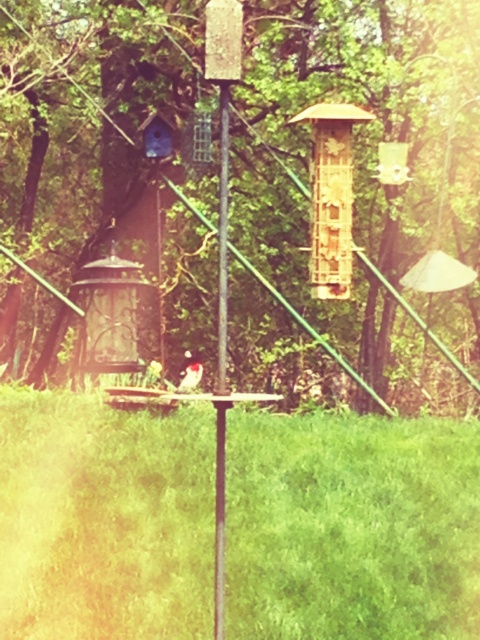
Does smooth wood pole at center have a larger size compared to white fluffy bird at center?

Yes.

Is smooth wood pole at center smaller than white fluffy bird at center?

No, smooth wood pole at center is not smaller than white fluffy bird at center.

Is point (218, 589) positioned in front of point (186, 358)?

Yes, it is.

Where is `smooth wood pole at center`? The width and height of the screenshot is (480, 640). smooth wood pole at center is located at coordinates (223, 241).

Is brown wooden birdhouse at center in front of smooth wood pole at center?

No, brown wooden birdhouse at center is behind smooth wood pole at center.

Does brown wooden birdhouse at center appear over smooth wood pole at center?

Yes.

Who is more forward, (x=272, y=148) or (x=224, y=176)?

Point (x=224, y=176) is more forward.

Locate an element on the screen. brown wooden birdhouse at center is located at coordinates (418, 320).

Does brown wooden birdhouse at center appear under white fluffy bird at center?

No, brown wooden birdhouse at center is not below white fluffy bird at center.

Does brown wooden birdhouse at center have a lesser width compared to white fluffy bird at center?

No, brown wooden birdhouse at center is not thinner than white fluffy bird at center.

What do you see at coordinates (418, 320) in the screenshot? This screenshot has height=640, width=480. I see `brown wooden birdhouse at center` at bounding box center [418, 320].

Locate an element on the screen. brown wooden birdhouse at center is located at coordinates (418, 320).